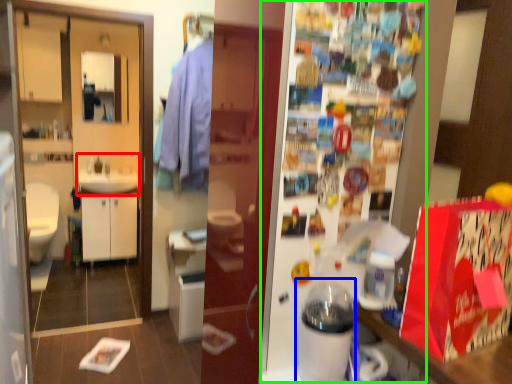
Question: Which object is positioned farthest from sink (highlighted by a red box)? Select from appliance (highlighted by a blue box) and fridge (highlighted by a green box).

Choices:
 (A) appliance
 (B) fridge

Answer: (A)